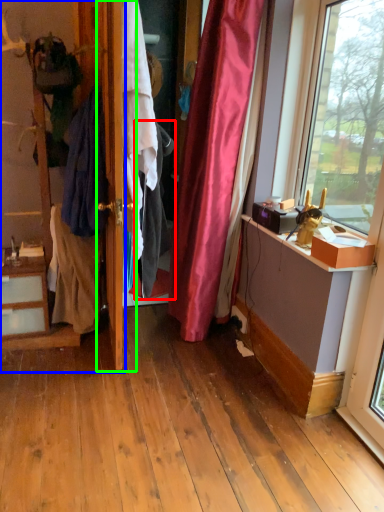
Question: Considering the real-world distances, which object is closest to clothing (highlighted by a red box)? dresser (highlighted by a blue box) or door (highlighted by a green box).

Choices:
 (A) dresser
 (B) door

Answer: (B)